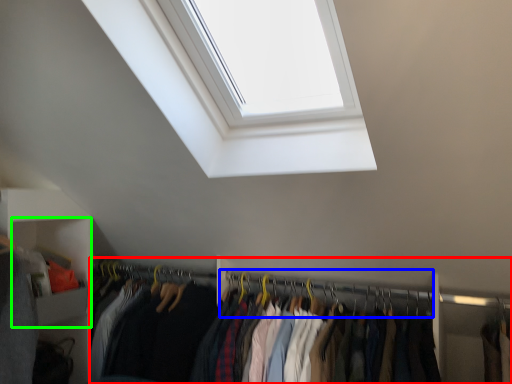
Question: Based on their relative distances, which object is nearer to closet (highlighted by a red box)? Choose from hanger (highlighted by a blue box) and cabinet (highlighted by a green box).

Choices:
 (A) hanger
 (B) cabinet

Answer: (A)